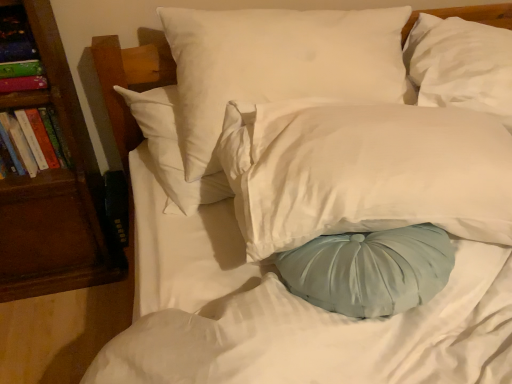
Question: In terms of width, does multicolored paper book at left, the 2th book ordered from the bottom, look wider or thinner when compared to white smooth pillow at upper center, the 1th pillow in the left-to-right sequence?

Choices:
 (A) thin
 (B) wide

Answer: (A)

Question: Is multicolored paper book at left, the 2th book ordered from the bottom, to the left or to the right of white smooth pillow at upper center, the 3th pillow when ordered from right to left, in the image?

Choices:
 (A) right
 (B) left

Answer: (B)

Question: Estimate the real-world distances between objects in this image. Which object is farther from the white smooth pillow at upper center, the 1th pillow in the left-to-right sequence?

Choices:
 (A) brown wood bookshelf at left
 (B) white satin pillow at upper right, the first pillow positioned from the right
 (C) white satin pillow at center, arranged as the 2th pillow when viewed from the left
 (D) multicolored paper book at left, the 2th book ordered from the bottom
 (E) hardcover book at left, the 1th book when ordered from bottom to top

Answer: (E)

Question: Which object is the closest to the white smooth pillow at upper center, the 1th pillow in the left-to-right sequence?

Choices:
 (A) white satin pillow at center, arranged as the 2th pillow when viewed from the left
 (B) brown wood bookshelf at left
 (C) white satin pillow at upper right, the first pillow positioned from the right
 (D) hardcover book at left, the 1th book when ordered from bottom to top
 (E) multicolored paper book at left, the first book when ordered from top to bottom

Answer: (A)